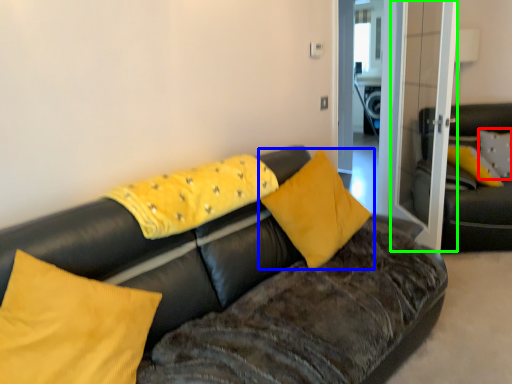
Question: Which is nearer to the pillow (highlighted by a red box)? pillow (highlighted by a blue box) or glass door (highlighted by a green box).

Choices:
 (A) pillow
 (B) glass door

Answer: (B)